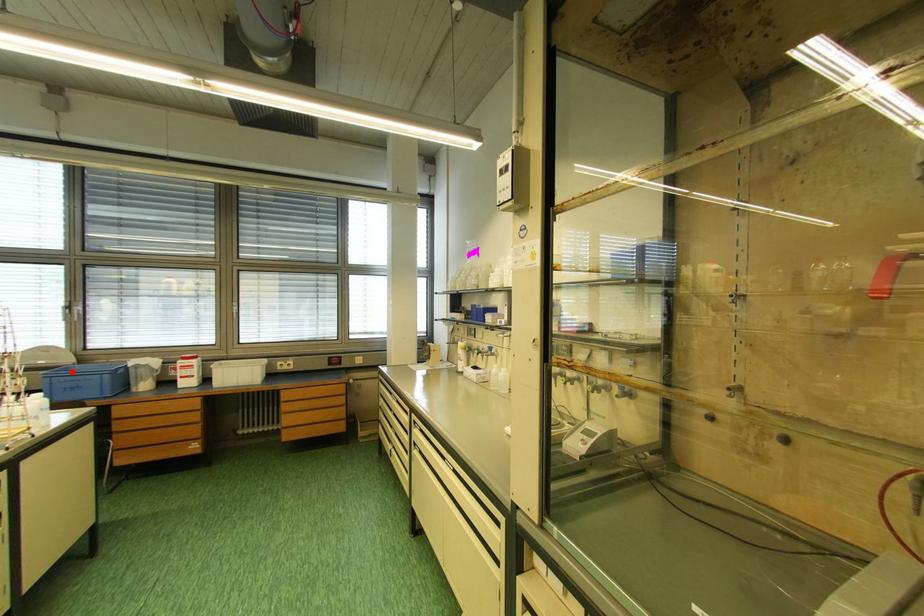
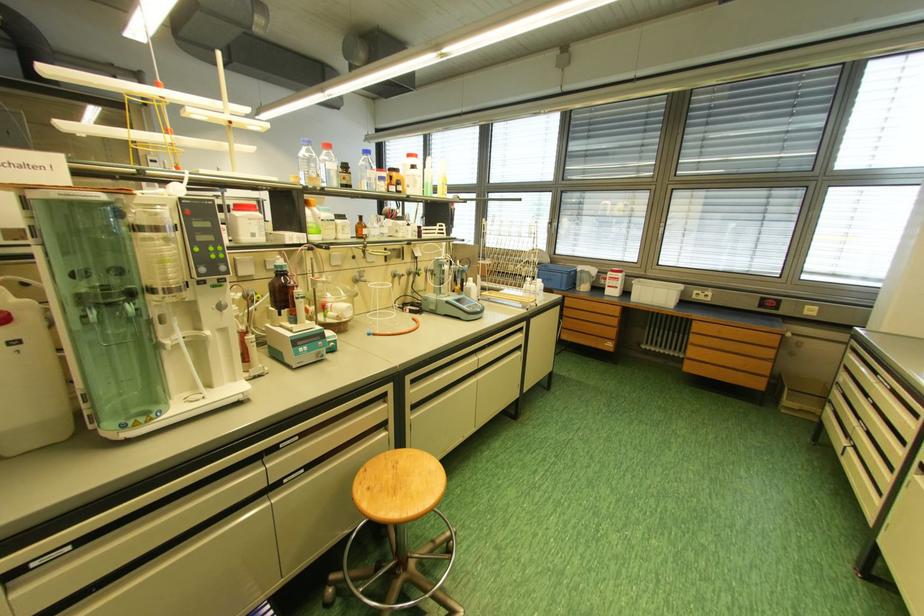
Question: I am providing you with two images of the same scene from different viewpoints. A red point is marked on the first image. At the location where the point appears in image 1, is it still visible in image 2?

Choices:
 (A) Yes
 (B) No

Answer: (A)